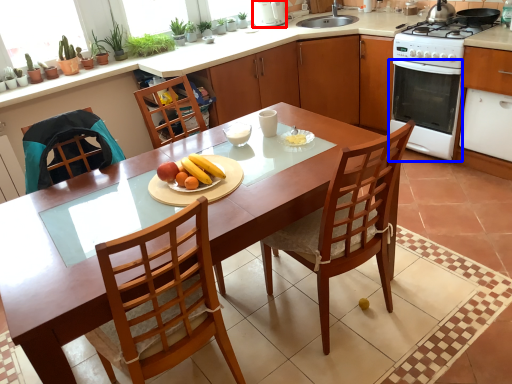
Question: Which point is closer to the camera, kitchen appliance (highlighted by a red box) or oven (highlighted by a blue box)?

Choices:
 (A) kitchen appliance
 (B) oven

Answer: (B)